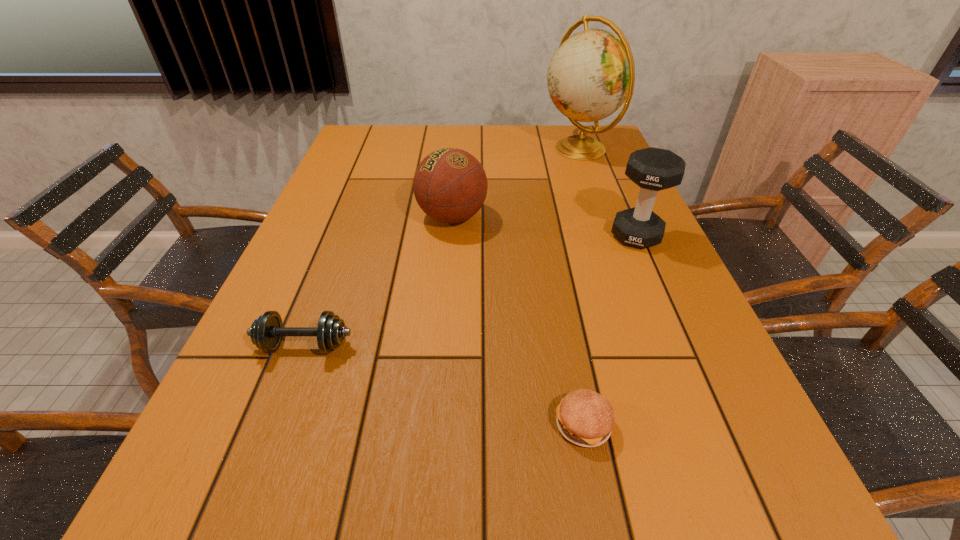
Where is `the tallest object`? the tallest object is located at coordinates (592, 73).

The width and height of the screenshot is (960, 540). In order to click on the farthest object in this screenshot , I will do `click(592, 73)`.

Identify the location of the taller dumbbell. (653, 169).

Image resolution: width=960 pixels, height=540 pixels. What are the coordinates of `the right dumbbell` in the screenshot? It's located at (653, 169).

This screenshot has height=540, width=960. Identify the location of the second object from left to right. (450, 185).

Identify the location of the shorter dumbbell. This screenshot has width=960, height=540. (266, 332).

I want to click on the left dumbbell, so click(266, 332).

The height and width of the screenshot is (540, 960). What are the coordinates of `hamburger` in the screenshot? It's located at (584, 417).

Locate an element on the screen. This screenshot has height=540, width=960. the shortest object is located at coordinates tap(584, 417).

Where is `free space located on the left of the farthest object`? This screenshot has width=960, height=540. free space located on the left of the farthest object is located at coordinates (526, 148).